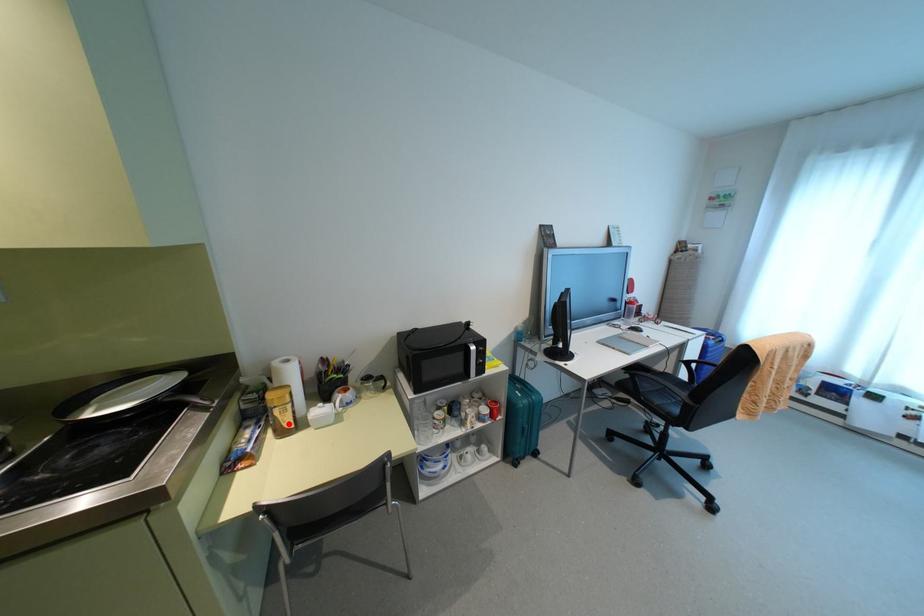
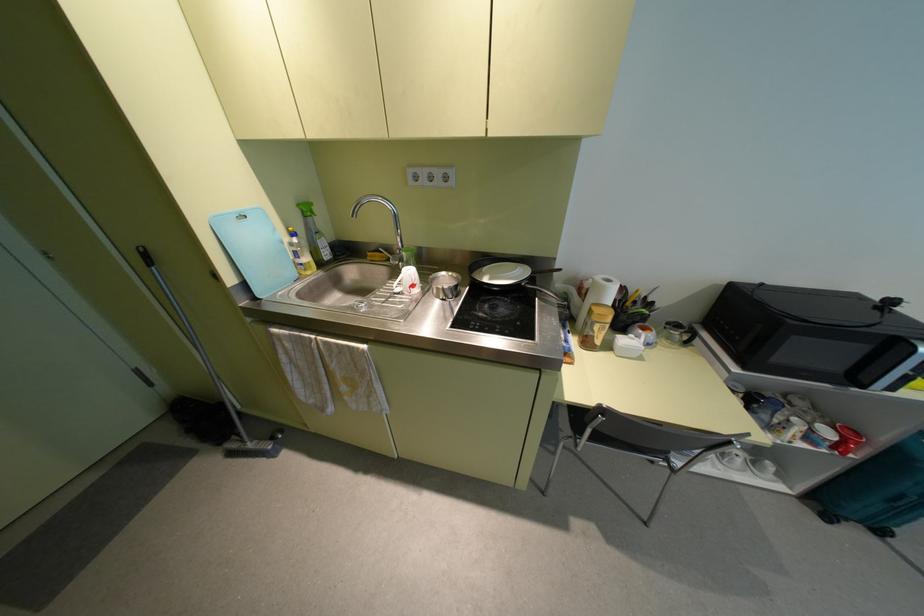
Locate, in the second image, the point that corresponds to the highlighted location in the first image.

(598, 341)